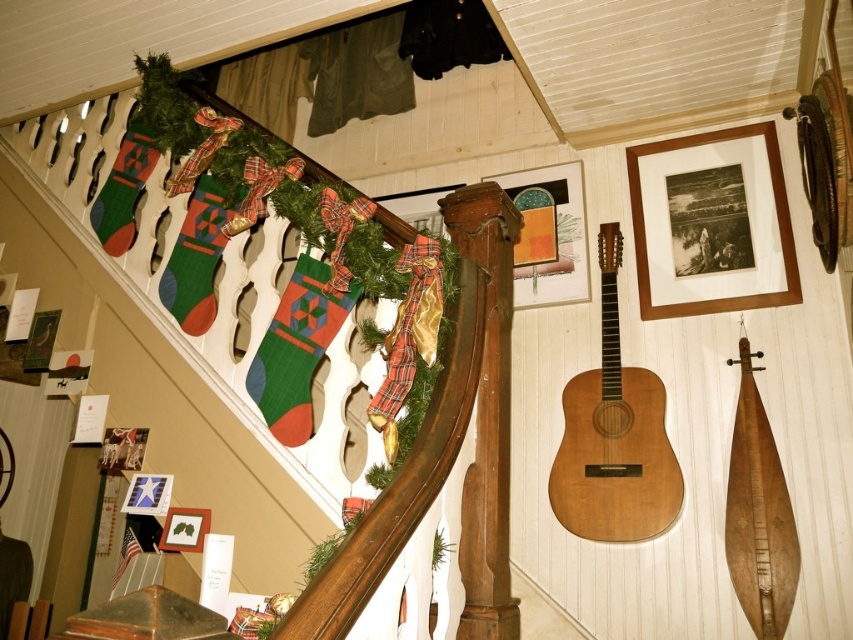
You are standing in the cozy indoor setting with festive decorations. There are two points marked in the scene. Can you determine which point is closer to you, point (x=576, y=440) or point (x=785, y=208)?

Point (x=576, y=440) is in front of point (x=785, y=208), so it is closer to you.